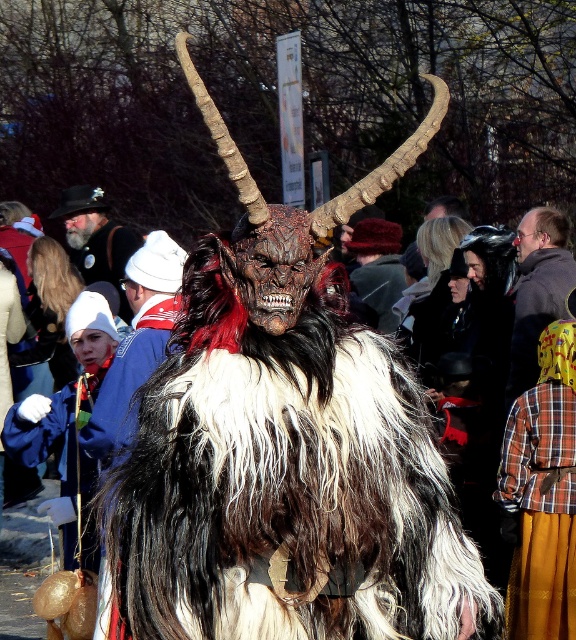
Question: Does plaid shirt at right have a lesser width compared to velvet red hat at center?

Choices:
 (A) no
 (B) yes

Answer: (B)

Question: Which of the following is the farthest from the observer?

Choices:
 (A) (540, 248)
 (B) (85, 260)

Answer: (B)

Question: Among these points, which one is nearest to the camera?

Choices:
 (A) (374, 296)
 (B) (247, 628)

Answer: (B)

Question: Does matte black hat at upper left have a greater width compared to velvet red hat at center?

Choices:
 (A) yes
 (B) no

Answer: (A)

Question: Estimate the real-world distances between objects in this image. Which object is closer to the matte black hat at upper left?

Choices:
 (A) velvet red hat at center
 (B) plaid shirt at right

Answer: (A)

Question: Is furry costume at center to the right of matte black hat at upper left from the viewer's perspective?

Choices:
 (A) yes
 (B) no

Answer: (A)